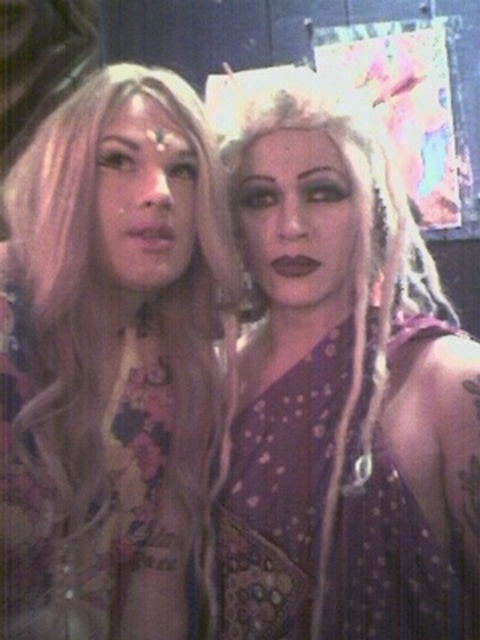
Question: Which object is closer to the camera taking this photo?

Choices:
 (A) matte purple dress at center
 (B) blonde hair at center

Answer: (B)

Question: Which of the following is the farthest from the observer?

Choices:
 (A) (43, 227)
 (B) (373, 506)

Answer: (A)

Question: In this image, where is matte purple dress at center located relative to blonde hair at center?

Choices:
 (A) above
 (B) below

Answer: (A)

Question: In this image, where is matte purple dress at center located relative to blonde hair at center?

Choices:
 (A) below
 (B) above

Answer: (B)

Question: Which of the following is the closest to the observer?

Choices:
 (A) blonde hair at center
 (B) matte purple dress at center

Answer: (A)

Question: Is matte purple dress at center positioned before blonde hair at center?

Choices:
 (A) yes
 (B) no

Answer: (B)